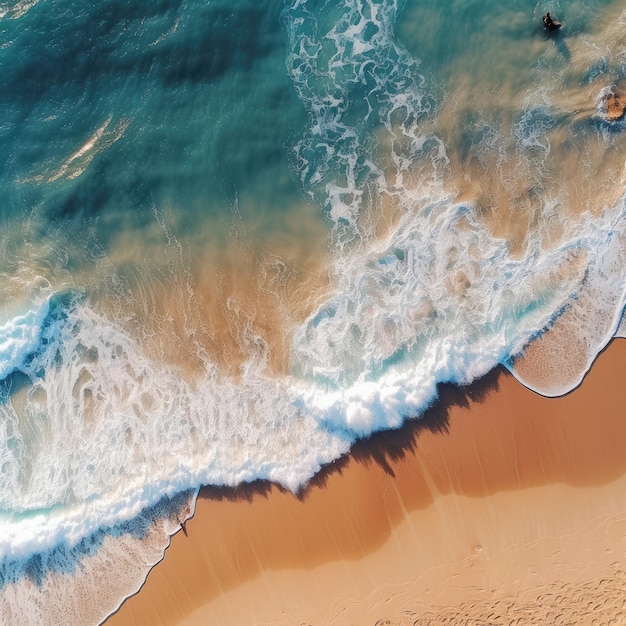
What are the coordinates of `foam` in the screenshot? It's located at (382, 386).